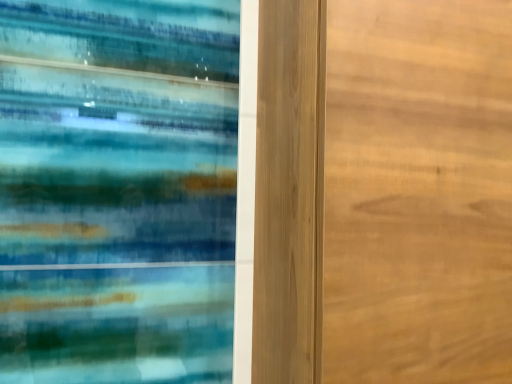
The width and height of the screenshot is (512, 384). What do you see at coordinates (418, 192) in the screenshot?
I see `wooden door at center` at bounding box center [418, 192].

Locate an element on the screen. Image resolution: width=512 pixels, height=384 pixels. wooden door at center is located at coordinates (418, 192).

The height and width of the screenshot is (384, 512). I want to click on wooden door at center, so click(x=418, y=192).